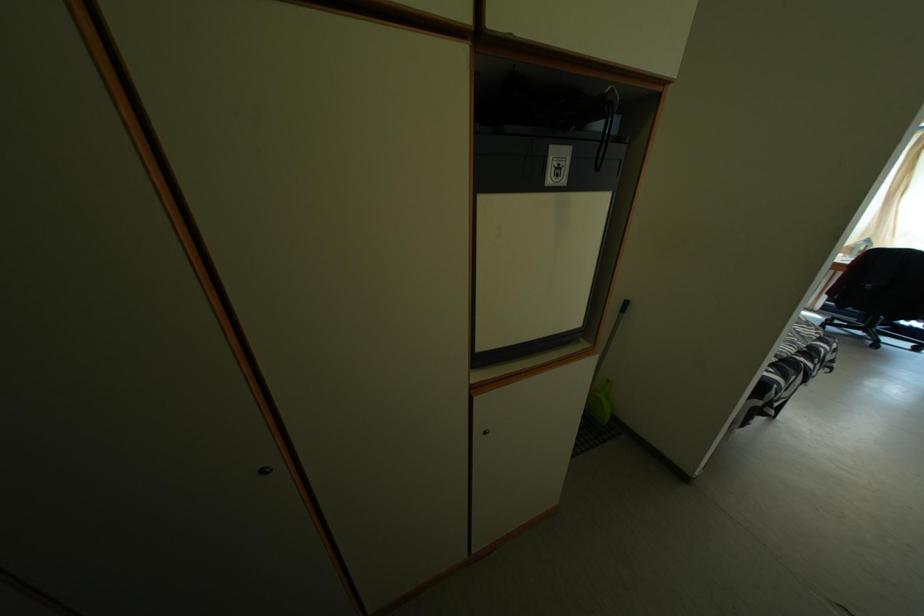
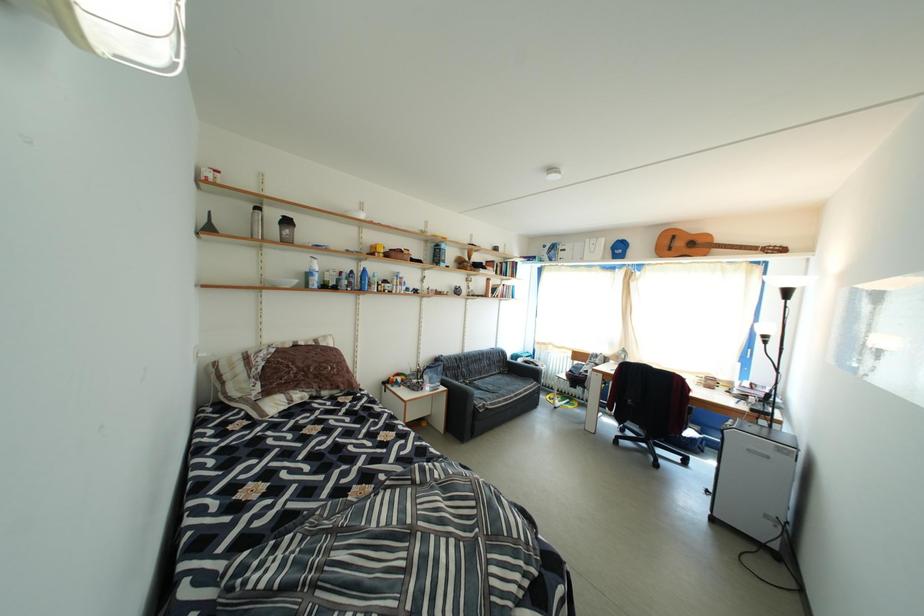
In a continuous first-person perspective shot, in which direction is the camera moving?

The cameraman walked toward right, forward.